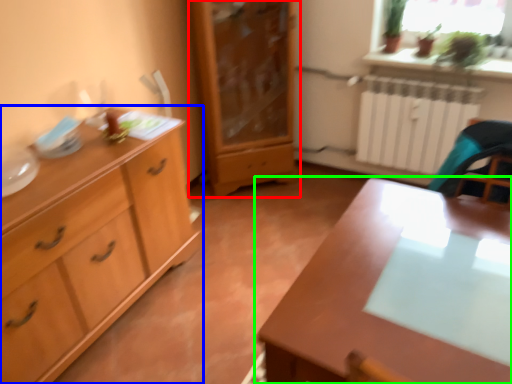
Question: Which object is positioned closest to chest of drawers (highlighted by a red box)? Select from chest of drawers (highlighted by a blue box) and table (highlighted by a green box).

Choices:
 (A) chest of drawers
 (B) table

Answer: (A)